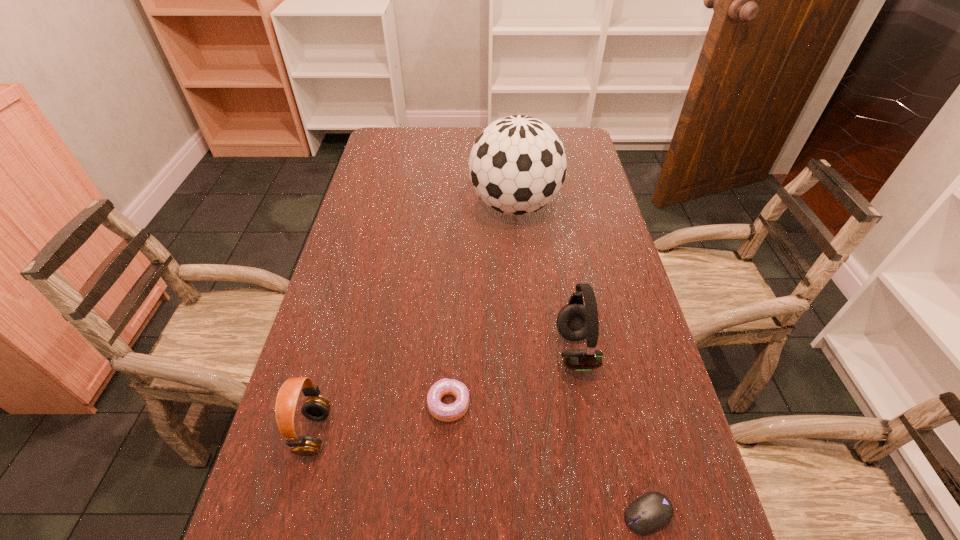
Find the location of `blank space at the left edge of the desktop`. blank space at the left edge of the desktop is located at coordinates (375, 212).

You are a GUI agent. You are given a task and a screenshot of the screen. Output one action in this format:
    pyautogui.click(x=<x>, y=<y>)
    Task: Click on the vacant space at the right edge of the desktop
    The height and width of the screenshot is (540, 960).
    Given the screenshot: What is the action you would take?
    pyautogui.click(x=653, y=362)

In the image, there is a desktop. Where is `vacant region at the far right corner`? This screenshot has width=960, height=540. vacant region at the far right corner is located at coordinates (586, 147).

Find the location of `empty space between the right headset and the farthest object`. empty space between the right headset and the farthest object is located at coordinates (545, 278).

Identify the location of vacant area between the farther headset and the soccer ball. Image resolution: width=960 pixels, height=540 pixels. (545, 278).

Where is `free spot between the shortest object and the nearer headset`? The width and height of the screenshot is (960, 540). free spot between the shortest object and the nearer headset is located at coordinates (481, 474).

The width and height of the screenshot is (960, 540). Identify the location of vacant region between the shorter headset and the shortest object. (481, 474).

This screenshot has width=960, height=540. Find the location of `empty location between the doughnut and the farthest object`. empty location between the doughnut and the farthest object is located at coordinates click(x=482, y=305).

The image size is (960, 540). Find the location of `vacant area that lies between the farther headset and the shortest object`. vacant area that lies between the farther headset and the shortest object is located at coordinates (612, 433).

I want to click on free space that is in between the nearer headset and the nearest object, so click(x=481, y=474).